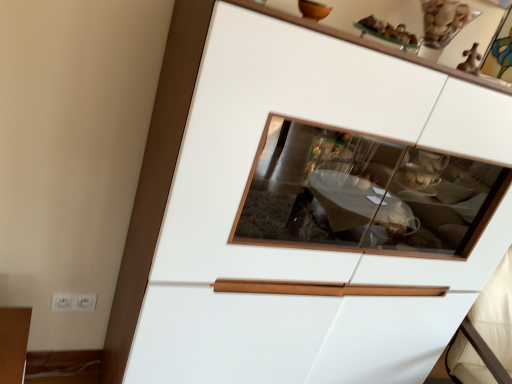
Question: Should I look upward or downward to see wooden picture frame at upper right?

Choices:
 (A) up
 (B) down

Answer: (A)